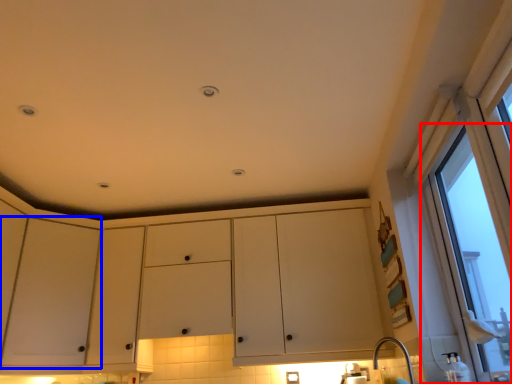
Question: Which object is further to the camera taking this photo, window (highlighted by a red box) or screen door (highlighted by a blue box)?

Choices:
 (A) window
 (B) screen door

Answer: (B)